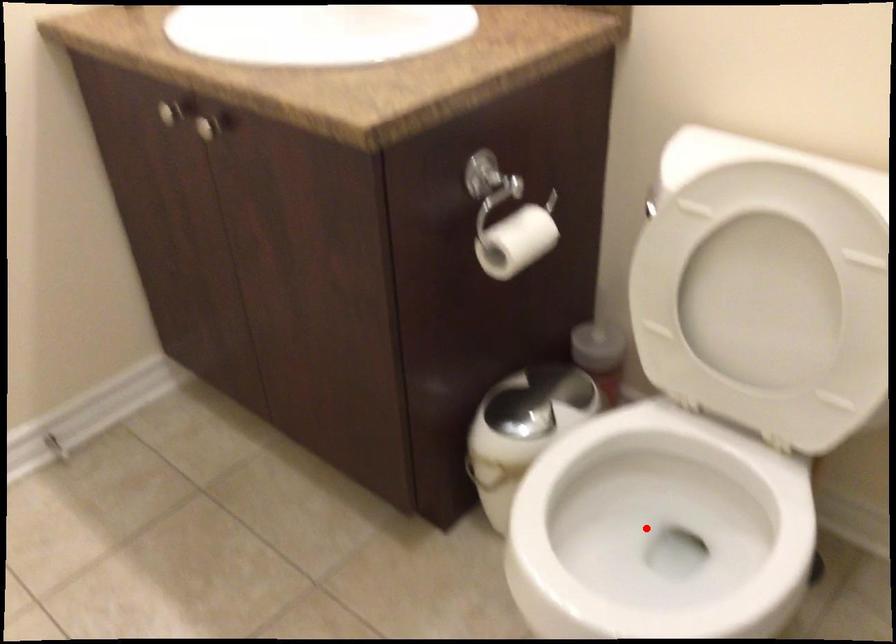
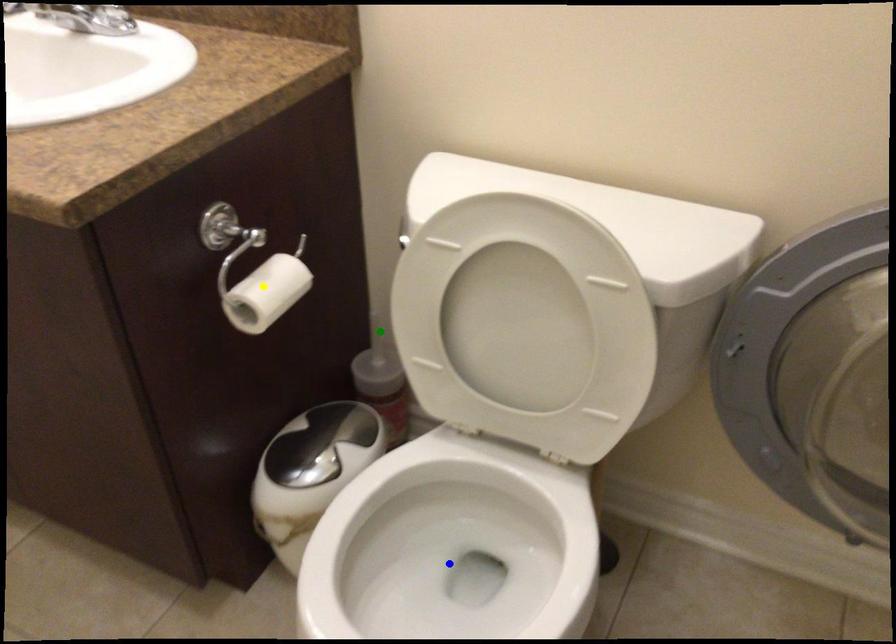
Question: I am providing you with two images of the same scene from different viewpoints. A red point is marked on the first image. You are given multiple points on the second image. In image 2, which mark is for the same physical point as the one in image 1?

Choices:
 (A) blue point
 (B) yellow point
 (C) green point

Answer: (A)